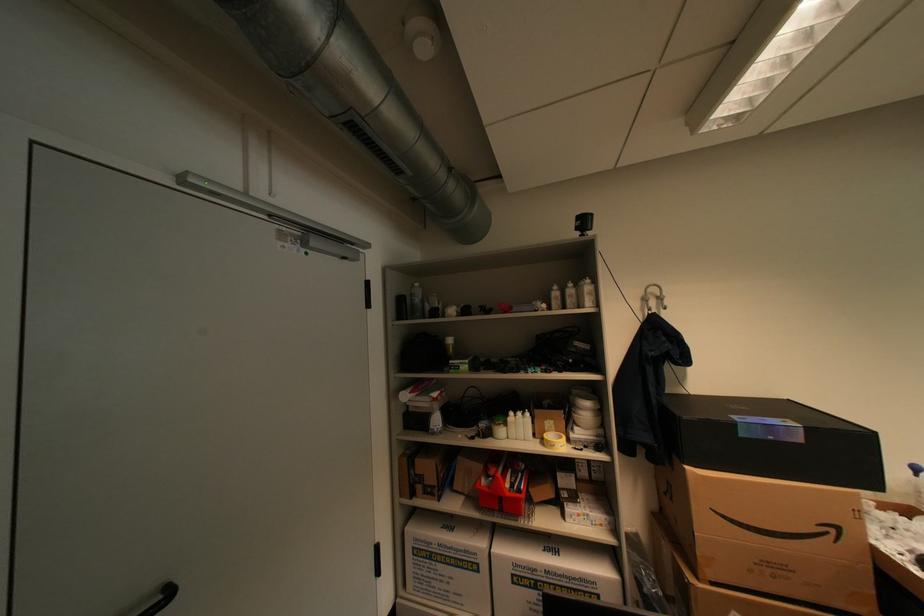
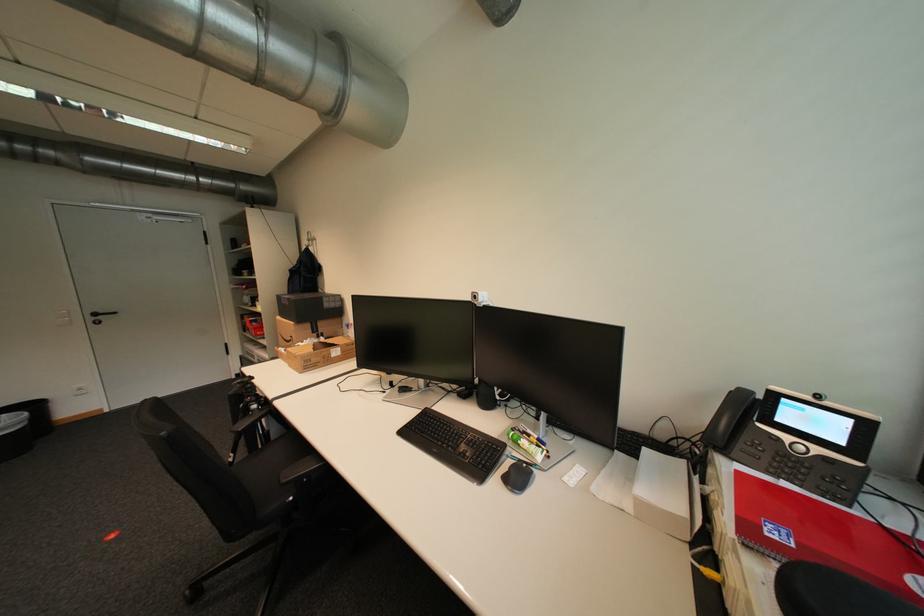
Locate, in the second image, the point that corresponds to (824,525) in the first image.

(299, 338)